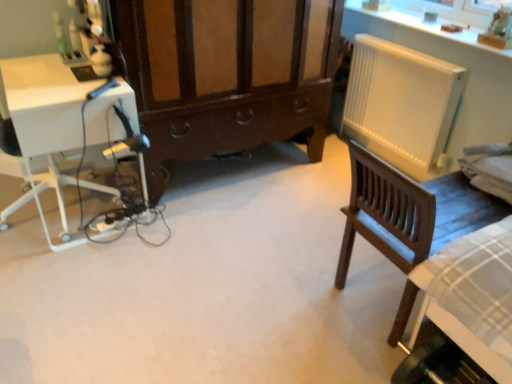
Where is `vacant region in front of brown wood cabinet at center`? The image size is (512, 384). vacant region in front of brown wood cabinet at center is located at coordinates (211, 256).